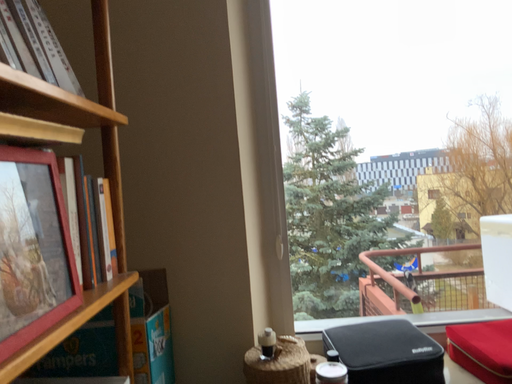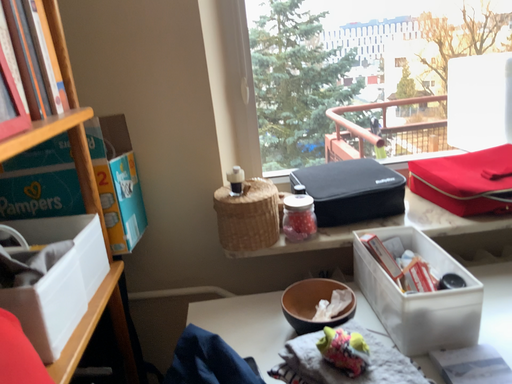
Question: Which way did the camera rotate in the video?

Choices:
 (A) rotated upward
 (B) rotated downward

Answer: (B)